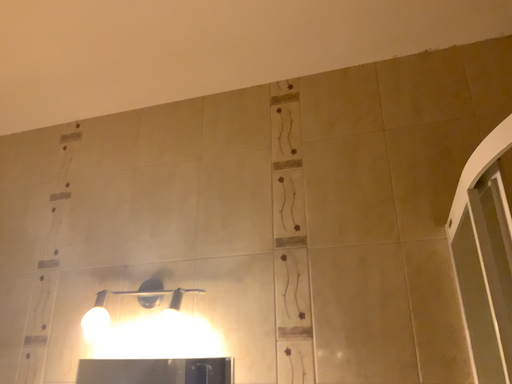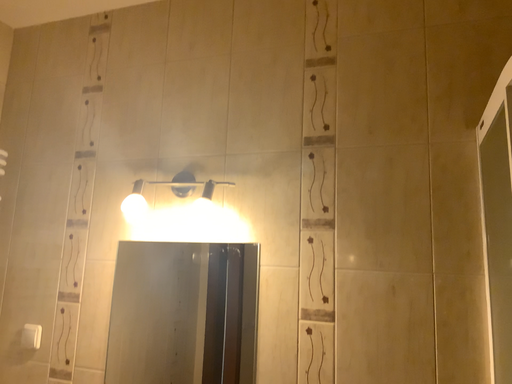
Question: Which way did the camera rotate in the video?

Choices:
 (A) rotated downward
 (B) rotated upward

Answer: (A)